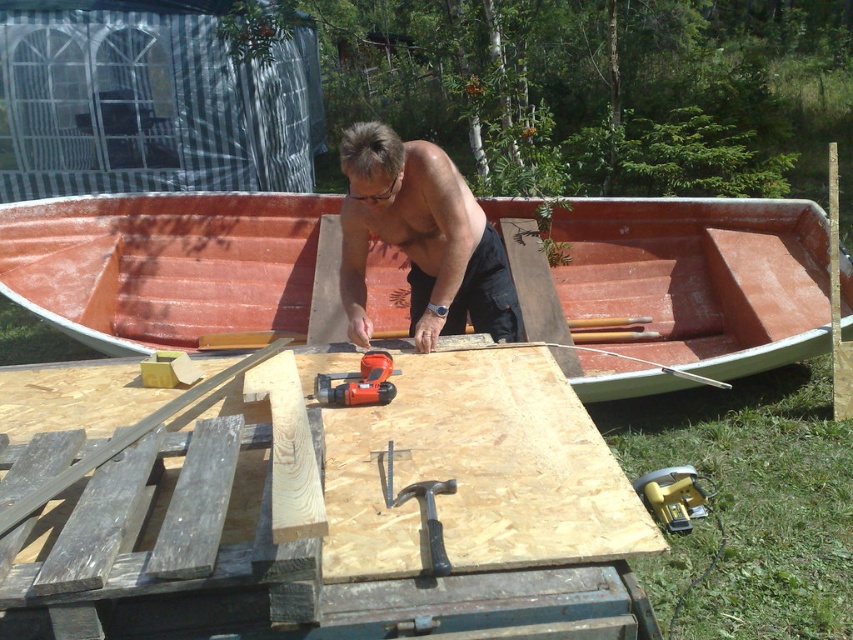
Between orange painted wood canoe at center and gold metallic nail gun at lower right, which one is positioned lower?

Positioned lower is gold metallic nail gun at lower right.

Does point (592, 273) lie behind point (639, 488)?

That is True.

Locate an element on the screen. The height and width of the screenshot is (640, 853). orange painted wood canoe at center is located at coordinates (161, 264).

Locate an element on the screen. The width and height of the screenshot is (853, 640). orange painted wood canoe at center is located at coordinates (161, 264).

Is shiny orange boat at center bigger than orange plastic drill at center?

Yes.

Which is more to the left, shiny orange boat at center or orange plastic drill at center?

From the viewer's perspective, orange plastic drill at center appears more on the left side.

Is point (444, 250) closer to viewer compared to point (363, 387)?

No, it is behind (363, 387).

Identify the location of shiny orange boat at center. This screenshot has width=853, height=640. (421, 240).

Does gold metallic nail gun at lower right have a greater height compared to orange plastic drill at center?

Correct, gold metallic nail gun at lower right is much taller as orange plastic drill at center.

Which is in front, point (654, 516) or point (387, 387)?

Positioned in front is point (387, 387).

Which is behind, point (660, 481) or point (339, 401)?

The point (660, 481) is behind.

Identify the location of gold metallic nail gun at lower right. (672, 497).